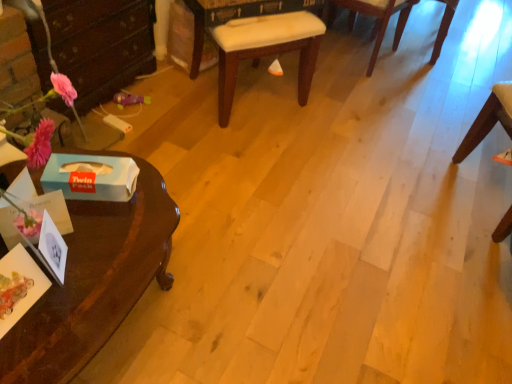
Identify the location of vacant point to the right of wooden chair at upper right, the third chair in the left-to-right sequence. 478,53.